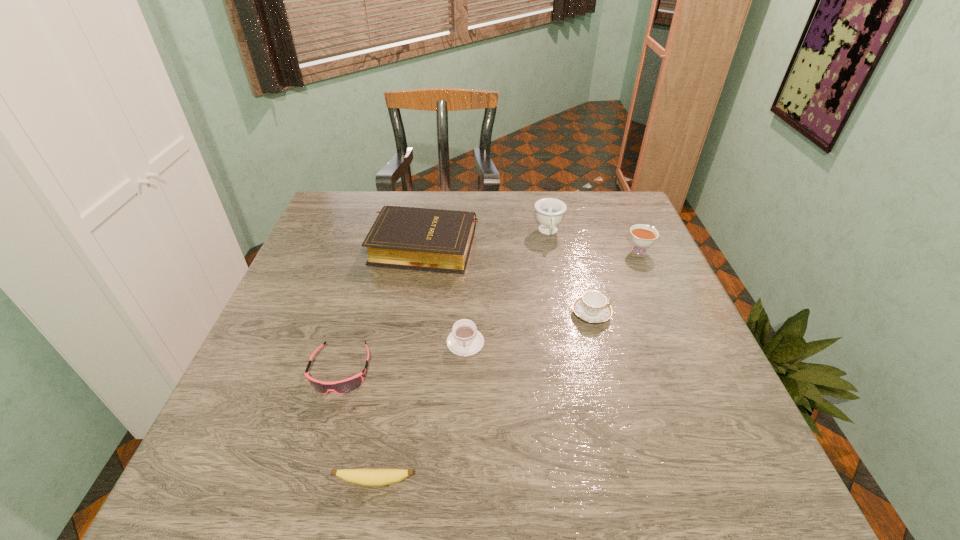
Where is `unoccupied position between the Bible and the banana`? The image size is (960, 540). unoccupied position between the Bible and the banana is located at coordinates (399, 363).

This screenshot has width=960, height=540. I want to click on free point between the fourth farthest object and the rightmost teacup, so click(615, 281).

Where is `vacant space that is in between the nearest object and the Bible`? The image size is (960, 540). vacant space that is in between the nearest object and the Bible is located at coordinates (399, 363).

The width and height of the screenshot is (960, 540). In order to click on vacant space in between the goggles and the third shortest teacup in this screenshot , I will do point(490,310).

Find the location of `free space that is in between the goggles and the Bible`. free space that is in between the goggles and the Bible is located at coordinates (382, 308).

This screenshot has height=540, width=960. In order to click on vacant area between the third shortest teacup and the tallest object in this screenshot , I will do `click(593, 241)`.

You are a GUI agent. You are given a task and a screenshot of the screen. Output one action in this format:
    pyautogui.click(x=<x>, y=<y>)
    Task: Click on the empty space between the goggles and the rightmost object
    
    Given the screenshot: What is the action you would take?
    pyautogui.click(x=490, y=310)

You are a GUI agent. You are given a task and a screenshot of the screen. Output one action in this format:
    pyautogui.click(x=<x>, y=<y>)
    Task: Click on the object that is the fourth closest to the Bible
    
    Given the screenshot: What is the action you would take?
    pyautogui.click(x=592, y=307)

At what (x,y) coordinates should I click in order to perform the action: click on object identified as the third closest to the tallest teacup. Please return your answer as a coordinate pair (x, y). Image resolution: width=960 pixels, height=540 pixels. Looking at the image, I should click on (592, 307).

Locate which teacup ranks fourth in proximity to the goggles. Please provide its 2D coordinates. Your answer should be formatted as a tuple, i.e. [(x, y)], where the tuple contains the x and y coordinates of a point satisfying the conditions above.

[(642, 236)]